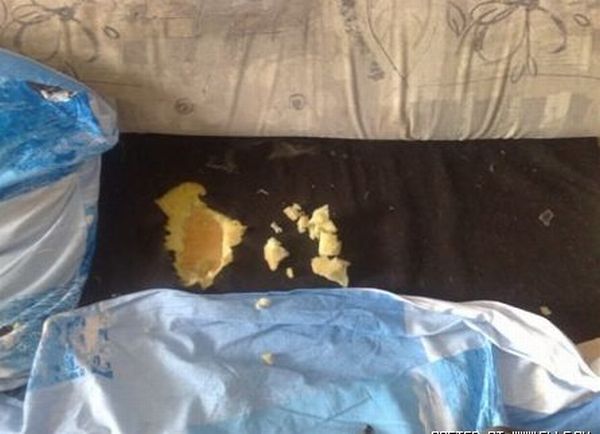
Where is `white fabric draped on side of box`? This screenshot has width=600, height=434. white fabric draped on side of box is located at coordinates (53, 250).